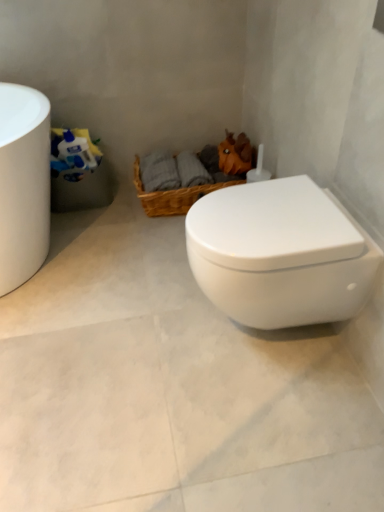
Question: Does white glossy toilet at center lie in front of woven brown basket at center?

Choices:
 (A) yes
 (B) no

Answer: (A)

Question: Is white glossy toilet at center positioned behind woven brown basket at center?

Choices:
 (A) yes
 (B) no

Answer: (B)

Question: Is white glossy toilet at center thinner than woven brown basket at center?

Choices:
 (A) no
 (B) yes

Answer: (B)

Question: Is woven brown basket at center surrounded by white glossy toilet at center?

Choices:
 (A) yes
 (B) no

Answer: (B)

Question: Does white glossy toilet at center appear on the left side of woven brown basket at center?

Choices:
 (A) yes
 (B) no

Answer: (B)

Question: Is woven brown basket at center inside or outside of white glossy toilet at center?

Choices:
 (A) inside
 (B) outside

Answer: (B)

Question: Does point (183, 199) appear closer or farther from the camera than point (226, 290)?

Choices:
 (A) farther
 (B) closer

Answer: (A)

Question: In the image, is woven brown basket at center positioned in front of or behind white glossy toilet at center?

Choices:
 (A) front
 (B) behind

Answer: (B)

Question: From their relative heights in the image, would you say woven brown basket at center is taller or shorter than white glossy toilet at center?

Choices:
 (A) short
 (B) tall

Answer: (A)

Question: From the image's perspective, is white glossy toilet at center positioned above or below woven brown basket at center?

Choices:
 (A) above
 (B) below

Answer: (B)

Question: Is point (82, 489) positioned closer to the camera than point (140, 184)?

Choices:
 (A) closer
 (B) farther

Answer: (A)

Question: From a real-world perspective, is white glossy toilet at center positioned above or below woven brown basket at center?

Choices:
 (A) above
 (B) below

Answer: (B)

Question: Relative to woven brown basket at center, is white glossy toilet at center in front or behind?

Choices:
 (A) front
 (B) behind

Answer: (A)

Question: From the image's perspective, relative to white glossy toilet at center, is white glossy toilet at center above or below?

Choices:
 (A) above
 (B) below

Answer: (A)

Question: In terms of height, does white glossy toilet at center look taller or shorter compared to white glossy toilet at center?

Choices:
 (A) tall
 (B) short

Answer: (A)